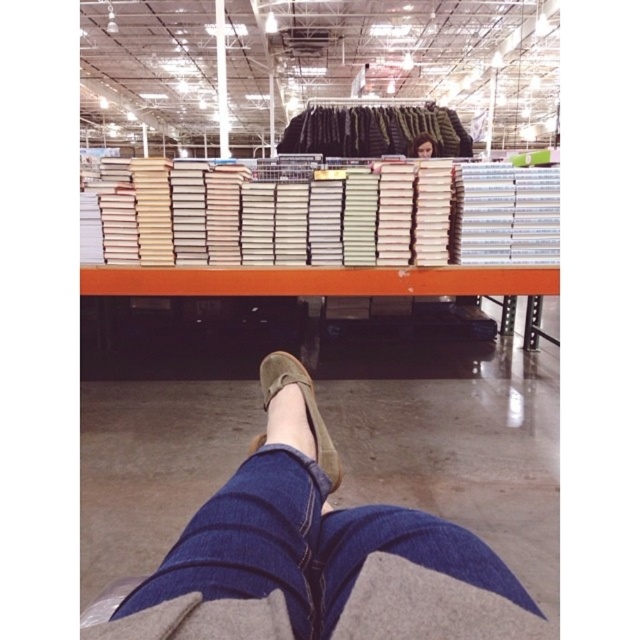
Question: Estimate the real-world distances between objects in this image. Which object is closer to the white paper books at center?

Choices:
 (A) smooth brown hair at upper center
 (B) denim pants at lower center

Answer: (B)

Question: Among these objects, which one is nearest to the camera?

Choices:
 (A) suede shoe at lower center
 (B) white paper books at center

Answer: (A)

Question: Which object is the closest to the denim pants at lower center?

Choices:
 (A) smooth brown hair at upper center
 (B) white paper books at center
 (C) suede shoe at lower center

Answer: (C)

Question: In this image, where is denim pants at lower center located relative to white paper books at center?

Choices:
 (A) left
 (B) right

Answer: (A)

Question: Can you confirm if white paper books at center is positioned above suede shoe at lower center?

Choices:
 (A) no
 (B) yes

Answer: (B)

Question: Observing the image, what is the correct spatial positioning of denim pants at lower center in reference to smooth brown hair at upper center?

Choices:
 (A) above
 (B) below

Answer: (B)